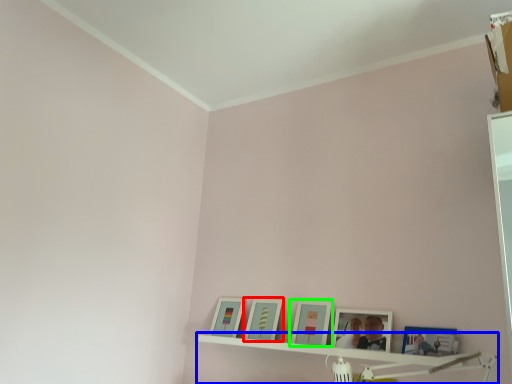
Question: Considering the real-world distances, which object is closest to picture frame (highlighted by a red box)? shelf (highlighted by a blue box) or picture frame (highlighted by a green box).

Choices:
 (A) shelf
 (B) picture frame

Answer: (B)